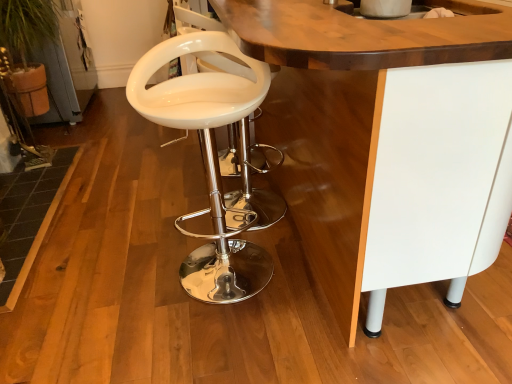
Question: In the image, is white glossy bar stool at center positioned in front of or behind white glossy table at center?

Choices:
 (A) behind
 (B) front

Answer: (A)

Question: Considering the positions of white glossy bar stool at center and white glossy table at center in the image, is white glossy bar stool at center wider or thinner than white glossy table at center?

Choices:
 (A) thin
 (B) wide

Answer: (A)

Question: Which of these objects is positioned farthest from the white glossy bar stool at center?

Choices:
 (A) white glossy sink at upper center
 (B) white glossy table at center

Answer: (A)

Question: Which object is the farthest from the white glossy table at center?

Choices:
 (A) white glossy bar stool at center
 (B) white glossy sink at upper center

Answer: (A)